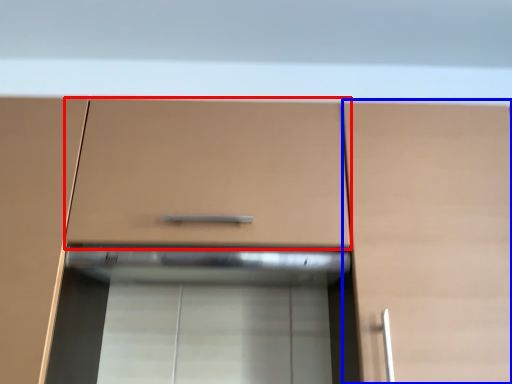
Question: Which object is closer to the camera taking this photo, drawer (highlighted by a red box) or cabinetry (highlighted by a blue box)?

Choices:
 (A) drawer
 (B) cabinetry

Answer: (B)